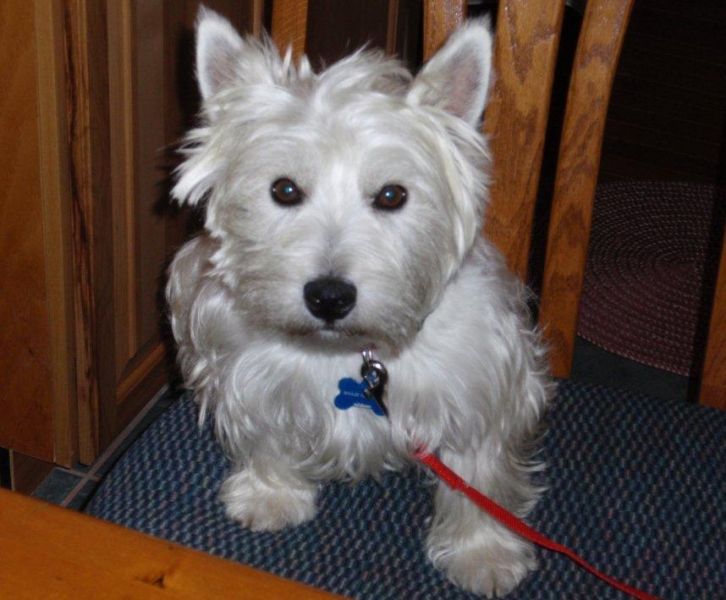
Where is `floor`? The width and height of the screenshot is (726, 600). floor is located at coordinates (643, 474).